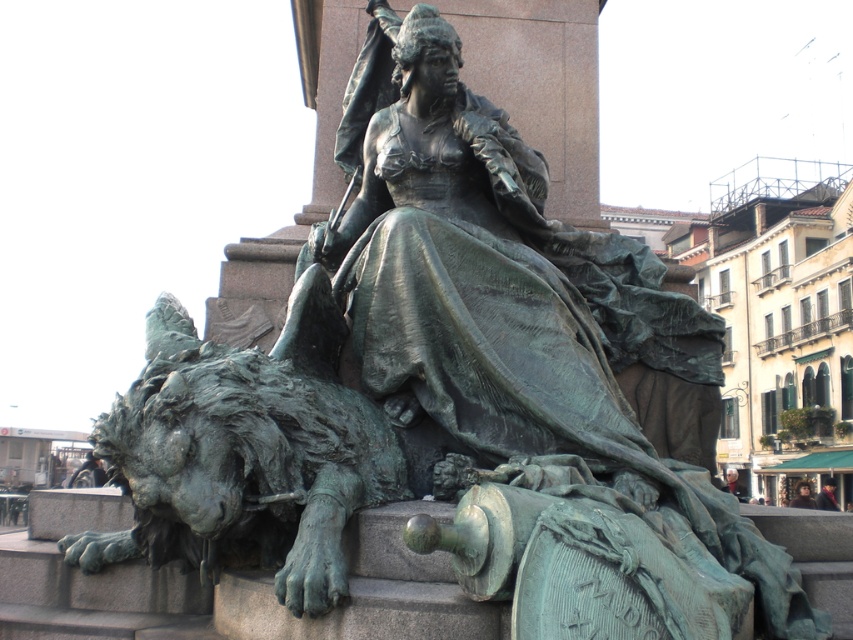
Based on the photo, can you confirm if green patina stone lion at lower left is taller than light brown hair at lower right?

No, green patina stone lion at lower left is not taller than light brown hair at lower right.

Does green patina stone lion at lower left have a lesser width compared to light brown hair at lower right?

Correct, green patina stone lion at lower left's width is less than light brown hair at lower right's.

Does point (312, 557) come farther from viewer compared to point (730, 484)?

No, (312, 557) is in front of (730, 484).

Find the location of a particular element. green patina stone lion at lower left is located at coordinates (245, 452).

Is bronze statue at center in front of green patina stone lion at lower left?

No, bronze statue at center is further to the viewer.

Describe the element at coordinates (490, 284) in the screenshot. I see `bronze statue at center` at that location.

The width and height of the screenshot is (853, 640). Identify the location of bronze statue at center. (490, 284).

Can you confirm if green patina stone lion at lower left is thinner than dark brown leather jacket at lower right?

Yes, green patina stone lion at lower left is thinner than dark brown leather jacket at lower right.

Can you confirm if green patina stone lion at lower left is positioned above dark brown leather jacket at lower right?

Yes.

Which is in front, point (135, 458) or point (834, 484)?

Point (135, 458) is more forward.

Where is `green patina stone lion at lower left`? This screenshot has height=640, width=853. green patina stone lion at lower left is located at coordinates (245, 452).